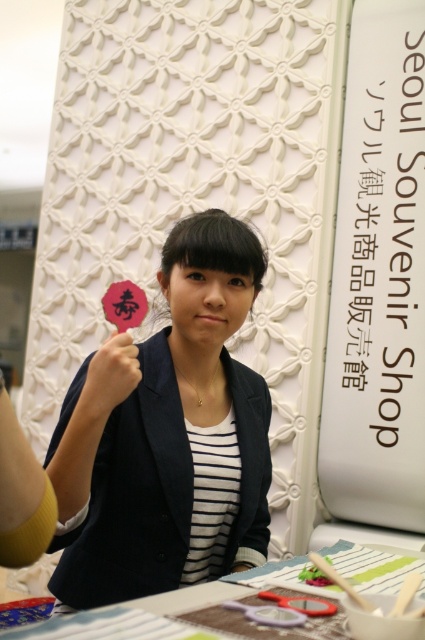
You are a photographer trying to capture the perfect shot of the scene. You notice two points in the image labeled as point 1 at coordinates (232, 504) and point 2 at coordinates (119, 369). Which point is closer to your camera lens?

Point 1 at coordinates (232, 504) is closer to the camera lens because it is further to the viewer than point 2 at coordinates (119, 369).

You are organizing a craft fair and need to determine if the matte black blazer at center can be placed on the wooden table at lower center without overhanging. Given that the table is wider, will the blazer fit entirely on the table?

The matte black blazer at center has a lesser width compared to the wooden table at lower center, so it will fit entirely on the table without overhanging.

You are organizing a craft fair and need to place the matte black blazer at center and the wooden table at lower center. Based on the scene, which object should be placed higher when setting up the display?

The matte black blazer at center should be placed higher since it is located above the wooden table at lower center in the original scene.